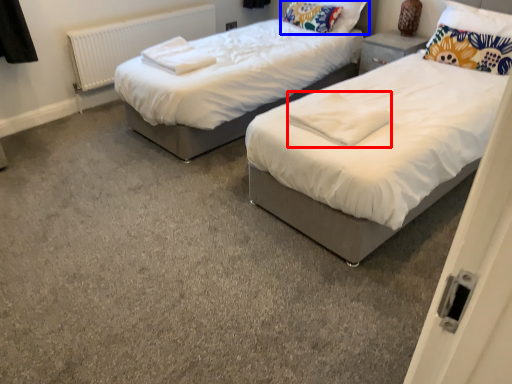
Question: Which of the following is the farthest to the observer, linen (highlighted by a red box) or pillow (highlighted by a blue box)?

Choices:
 (A) linen
 (B) pillow

Answer: (B)